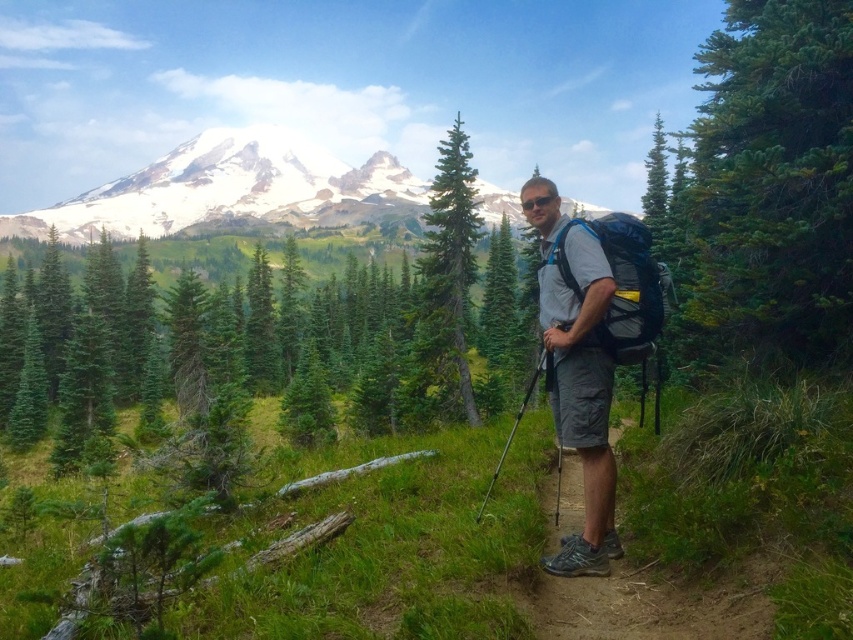
Question: Can you confirm if green textured pine tree at center is smaller than matte gray backpack at center-right?

Choices:
 (A) yes
 (B) no

Answer: (B)

Question: Is gray fabric backpack at center-right positioned before gray fabric backpack at center?

Choices:
 (A) yes
 (B) no

Answer: (A)

Question: Which of the following is the closest to the observer?

Choices:
 (A) green textured pine tree at center
 (B) matte gray backpack at center-right
 (C) snowy white mountain at upper center
 (D) green textured pine tree at center-right

Answer: (B)

Question: Which object is the farthest from the green textured pine tree at center?

Choices:
 (A) green textured pine tree at center-right
 (B) matte gray backpack at center-right
 (C) gray fabric backpack at center
 (D) snowy white mountain at upper center

Answer: (D)

Question: Is snowy white mountain at upper center above gray fabric backpack at center-right?

Choices:
 (A) yes
 (B) no

Answer: (A)

Question: Which point is farther to the camera?

Choices:
 (A) (590, 438)
 (B) (431, 218)
 (C) (531, 611)
 (D) (827, 237)

Answer: (B)